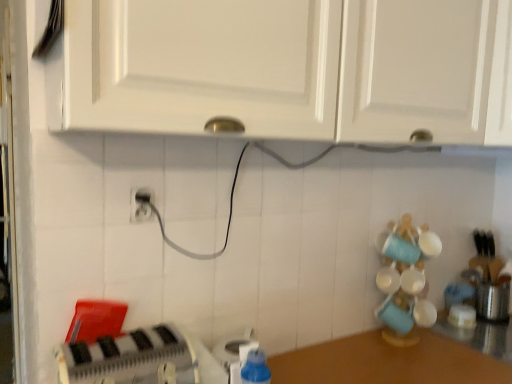
In order to face white matte cabinet at upper center, arranged as the 2th cabinetry when viewed from the left, should I rotate leftwards or rightwards?

Rotate your view right by about 27.473°.

The image size is (512, 384). What do you see at coordinates (493, 301) in the screenshot?
I see `satin silver toaster at right, the 1th appliance in the right-to-left sequence` at bounding box center [493, 301].

Describe the element at coordinates (234, 351) in the screenshot. Image resolution: width=512 pixels, height=384 pixels. I see `blue plastic soap dispenser at lower center, the 2th appliance in the front-to-back sequence` at that location.

This screenshot has width=512, height=384. Identify the location of blue plastic soap dispenser at lower center, acting as the 2th appliance starting from the back. (234, 351).

Locate an element on the screen. The image size is (512, 384). blue plastic bottle at lower center is located at coordinates (255, 368).

Which is behind, white plastic toaster at lower left, which is the 3th appliance in back-to-front order, or brown wooden counter at lower right?

brown wooden counter at lower right.

Would you say white plastic toaster at lower left, marked as the 3th appliance in a right-to-left arrangement, is inside or outside brown wooden counter at lower right?

white plastic toaster at lower left, marked as the 3th appliance in a right-to-left arrangement, is outside brown wooden counter at lower right.

Which is more to the right, white plastic toaster at lower left, which is the first appliance from front to back, or brown wooden counter at lower right?

Positioned to the right is brown wooden counter at lower right.

Is point (178, 350) closer to viewer compared to point (334, 371)?

Yes.

From the image's perspective, count 2nd cabinetrys upward from the satin silver toaster at right, the 1th appliance in the back-to-front sequence, and point to it. Please provide its 2D coordinates.

[(426, 71)]

Is white matte cabinet at upper center, arranged as the 2th cabinetry when viewed from the left, facing away from satin silver toaster at right, the third appliance viewed from the front?

No.

Measure the distance from white matte cabinet at upper center, arranged as the 1th cabinetry when viewed from the right, to satin silver toaster at right, the 1th appliance in the right-to-left sequence.

white matte cabinet at upper center, arranged as the 1th cabinetry when viewed from the right, is 37.44 inches from satin silver toaster at right, the 1th appliance in the right-to-left sequence.

Is white matte cabinet at upper center, arranged as the 2th cabinetry when viewed from the left, next to satin silver toaster at right, the 1th appliance in the back-to-front sequence, and touching it?

No, white matte cabinet at upper center, arranged as the 2th cabinetry when viewed from the left, is not touching satin silver toaster at right, the 1th appliance in the back-to-front sequence.

Can you tell me how much white matte cabinet at upper center, placed as the 1th cabinetry when sorted from left to right, and white matte cabinet at upper center, arranged as the 1th cabinetry when viewed from the right, differ in facing direction?

They differ by 43.8 degrees in their facing directions.

Is white matte cabinet at upper center, placed as the 1th cabinetry when sorted from left to right, positioned with its back to white matte cabinet at upper center, arranged as the 1th cabinetry when viewed from the right?

That's not correct — white matte cabinet at upper center, placed as the 1th cabinetry when sorted from left to right, is not looking away from white matte cabinet at upper center, arranged as the 1th cabinetry when viewed from the right.

Are white matte cabinet at upper center, placed as the 1th cabinetry when sorted from left to right, and white matte cabinet at upper center, arranged as the 1th cabinetry when viewed from the right, far apart?

white matte cabinet at upper center, placed as the 1th cabinetry when sorted from left to right, is actually quite close to white matte cabinet at upper center, arranged as the 1th cabinetry when viewed from the right.

Between white matte cabinet at upper center, placed as the 2th cabinetry when sorted from right to left, and white matte cabinet at upper center, arranged as the 1th cabinetry when viewed from the right, which one has smaller size?

white matte cabinet at upper center, arranged as the 1th cabinetry when viewed from the right, is smaller.

From the picture: Is white ceramic mug at right oriented away from satin silver toaster at right, the 1th appliance in the right-to-left sequence?

No, satin silver toaster at right, the 1th appliance in the right-to-left sequence, is not at the back of white ceramic mug at right.

From the image's perspective, which is above, white ceramic mug at right or satin silver toaster at right, marked as the third appliance in a left-to-right arrangement?

white ceramic mug at right.

Consider the image. Does white ceramic mug at right have a lesser width compared to satin silver toaster at right, the 1th appliance in the right-to-left sequence?

Indeed, white ceramic mug at right has a lesser width compared to satin silver toaster at right, the 1th appliance in the right-to-left sequence.

Does point (398, 322) come farther from viewer compared to point (47, 95)?

Yes, it is behind point (47, 95).

Looking at this image, is white matte cabinet at upper center, placed as the 2th cabinetry when sorted from right to left, at the back of white ceramic mug at right?

white ceramic mug at right does not have its back to white matte cabinet at upper center, placed as the 2th cabinetry when sorted from right to left.

Between white ceramic mug at right and white matte cabinet at upper center, placed as the 1th cabinetry when sorted from left to right, which one has smaller width?

Thinner between the two is white ceramic mug at right.

From the picture: From the image's perspective, is white plastic electric outlet at center below brown wooden counter at lower right?

Actually, white plastic electric outlet at center appears above brown wooden counter at lower right in the image.

Does white plastic electric outlet at center have a greater height compared to brown wooden counter at lower right?

Indeed, white plastic electric outlet at center has a greater height compared to brown wooden counter at lower right.

Can brown wooden counter at lower right be found inside white plastic electric outlet at center?

No, brown wooden counter at lower right is located outside of white plastic electric outlet at center.

In terms of width, does white plastic electric outlet at center look wider or thinner when compared to brown wooden counter at lower right?

Clearly, white plastic electric outlet at center has less width compared to brown wooden counter at lower right.

Is point (509, 283) in front of point (374, 50)?

No.

From the satin silver toaster at right, marked as the third appliance in a left-to-right arrangement, count the 1st cabinetry to the left and point to it. Please provide its 2D coordinates.

[(426, 71)]

From the image's perspective, is satin silver toaster at right, the 1th appliance in the right-to-left sequence, above or below white matte cabinet at upper center, arranged as the 1th cabinetry when viewed from the right?

From the image's perspective, satin silver toaster at right, the 1th appliance in the right-to-left sequence, appears below white matte cabinet at upper center, arranged as the 1th cabinetry when viewed from the right.

Who is bigger, satin silver toaster at right, the third appliance viewed from the front, or white matte cabinet at upper center, arranged as the 1th cabinetry when viewed from the right?

white matte cabinet at upper center, arranged as the 1th cabinetry when viewed from the right.

This screenshot has width=512, height=384. Find the location of `counter top behind the white plastic toaster at lower left, marked as the 3th appliance in a right-to-left arrangement`. counter top behind the white plastic toaster at lower left, marked as the 3th appliance in a right-to-left arrangement is located at coordinates (388, 362).

There is a satin silver toaster at right, the third appliance viewed from the front. Find the location of `the 2nd cabinetry above it (from the image's perspective)`. the 2nd cabinetry above it (from the image's perspective) is located at coordinates (426, 71).

Considering their positions, is white plastic electric outlet at center positioned further to white ceramic mug at right than satin silver toaster at right, the third appliance viewed from the front?

white plastic electric outlet at center.

Which object lies further to the anchor point white matte cabinet at upper center, arranged as the 2th cabinetry when viewed from the left, brown wooden counter at lower right or blue plastic soap dispenser at lower center, the 2th appliance from the left?

blue plastic soap dispenser at lower center, the 2th appliance from the left, is further to white matte cabinet at upper center, arranged as the 2th cabinetry when viewed from the left.

Estimate the real-world distances between objects in this image. Which object is further from white ceramic mug at right, white matte cabinet at upper center, arranged as the 2th cabinetry when viewed from the left, or white plastic toaster at lower left, marked as the 3th appliance in a right-to-left arrangement?

white plastic toaster at lower left, marked as the 3th appliance in a right-to-left arrangement, lies further to white ceramic mug at right than the other object.

Estimate the real-world distances between objects in this image. Which object is further from blue plastic bottle at lower center, white ceramic mug at right or white matte cabinet at upper center, placed as the 2th cabinetry when sorted from right to left?

Based on the image, white matte cabinet at upper center, placed as the 2th cabinetry when sorted from right to left, appears to be further to blue plastic bottle at lower center.

Estimate the real-world distances between objects in this image. Which object is closer to blue plastic soap dispenser at lower center, marked as the 2th appliance in a right-to-left arrangement, white matte cabinet at upper center, placed as the 2th cabinetry when sorted from right to left, or white plastic toaster at lower left, marked as the 3th appliance in a right-to-left arrangement?

white plastic toaster at lower left, marked as the 3th appliance in a right-to-left arrangement, lies closer to blue plastic soap dispenser at lower center, marked as the 2th appliance in a right-to-left arrangement, than the other object.

Looking at the image, which one is located further to satin silver toaster at right, the 1th appliance in the back-to-front sequence, blue plastic soap dispenser at lower center, the 2th appliance in the front-to-back sequence, or white plastic electric outlet at center?

Among the two, white plastic electric outlet at center is located further to satin silver toaster at right, the 1th appliance in the back-to-front sequence.

Estimate the real-world distances between objects in this image. Which object is closer to brown wooden counter at lower right, white matte cabinet at upper center, placed as the 1th cabinetry when sorted from left to right, or white plastic electric outlet at center?

white matte cabinet at upper center, placed as the 1th cabinetry when sorted from left to right, lies closer to brown wooden counter at lower right than the other object.

From the image, which object appears to be farther from blue plastic bottle at lower center, white plastic toaster at lower left, marked as the 3th appliance in a right-to-left arrangement, or satin silver toaster at right, marked as the third appliance in a left-to-right arrangement?

satin silver toaster at right, marked as the third appliance in a left-to-right arrangement, is positioned further to the anchor blue plastic bottle at lower center.

Find the location of a particular element. toy between white plastic toaster at lower left, the first appliance viewed from the left, and white matte cabinet at upper center, arranged as the 1th cabinetry when viewed from the right, from left to right is located at coordinates [406, 282].

Find the location of a particular element. The width and height of the screenshot is (512, 384). cabinetry between white plastic electric outlet at center and white matte cabinet at upper center, arranged as the 2th cabinetry when viewed from the left, from left to right is located at coordinates (287, 69).

At what (x,y) coordinates should I click in order to perform the action: click on bottle located between white plastic toaster at lower left, which is the 3th appliance in back-to-front order, and blue plastic soap dispenser at lower center, the 2th appliance from the left, in the depth direction. Please return your answer as a coordinate pair (x, y). Looking at the image, I should click on (255, 368).

Find the location of a particular element. The width and height of the screenshot is (512, 384). toy between white plastic toaster at lower left, which is the 3th appliance in back-to-front order, and satin silver toaster at right, the 1th appliance in the right-to-left sequence is located at coordinates (406, 282).